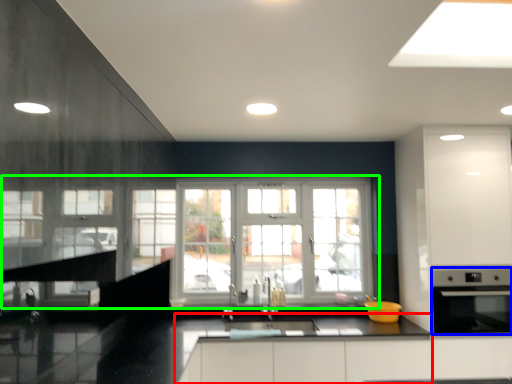
Question: Estimate the real-world distances between objects in this image. Which object is farther from counter top (highlighted by a red box), appliance (highlighted by a blue box) or window (highlighted by a green box)?

Choices:
 (A) appliance
 (B) window

Answer: (B)